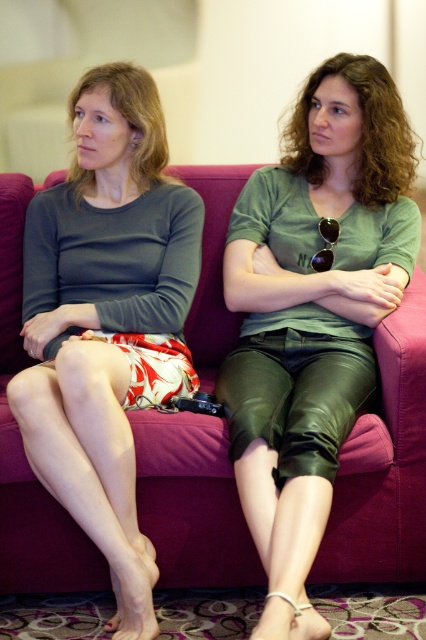
Question: Which point appears closest to the camera in this image?

Choices:
 (A) (172, 352)
 (B) (244, 476)
 (C) (342, 564)

Answer: (B)

Question: Does green leather pants at center appear over magenta fabric couch at center?

Choices:
 (A) yes
 (B) no

Answer: (A)

Question: Observing the image, what is the correct spatial positioning of green leather pants at center in reference to matte gray skirt at left?

Choices:
 (A) above
 (B) below

Answer: (A)

Question: Which object appears closest to the camera in this image?

Choices:
 (A) matte gray skirt at left
 (B) magenta fabric couch at center
 (C) green leather pants at center

Answer: (C)

Question: Considering the real-world distances, which object is farthest from the matte gray skirt at left?

Choices:
 (A) magenta fabric couch at center
 (B) green leather pants at center

Answer: (B)

Question: Does matte gray skirt at left have a lesser width compared to magenta fabric couch at center?

Choices:
 (A) yes
 (B) no

Answer: (A)